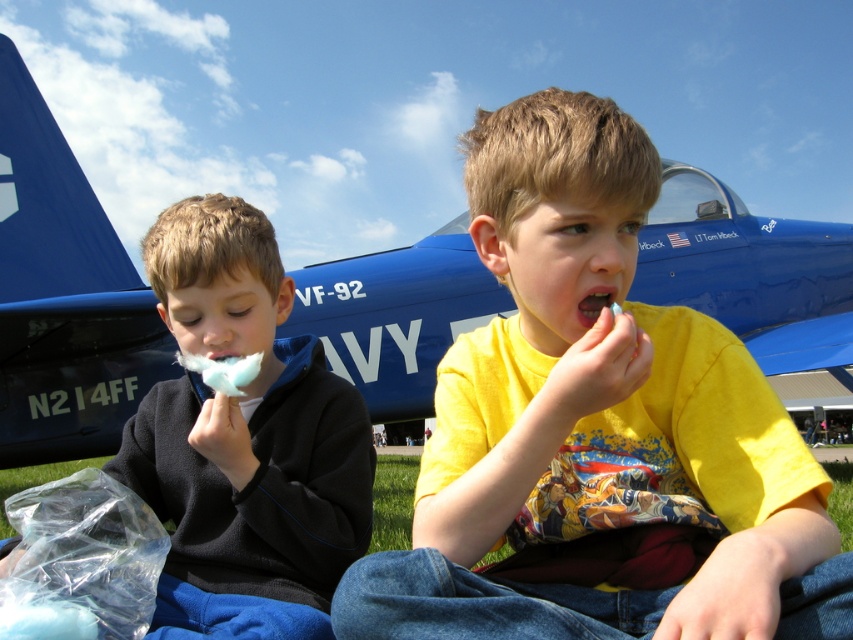
Measure the distance between yellow cotton candy at center and white fluffy cotton candy at left.

They are 70.34 centimeters apart.

Does yellow cotton candy at center have a larger size compared to white fluffy cotton candy at left?

Correct, yellow cotton candy at center is larger in size than white fluffy cotton candy at left.

Between point (735, 540) and point (177, 595), which one is positioned in front?

Point (735, 540) is in front.

Where is `yellow cotton candy at center`? Image resolution: width=853 pixels, height=640 pixels. yellow cotton candy at center is located at coordinates (598, 429).

Between blue glossy airplane at center and white fluffy cotton candy at left, which one appears on the left side from the viewer's perspective?

Positioned to the left is white fluffy cotton candy at left.

Is point (68, 321) closer to viewer compared to point (184, 588)?

No, it is not.

This screenshot has width=853, height=640. I want to click on blue glossy airplane at center, so click(x=62, y=296).

Can you confirm if yellow cotton candy at center is smaller than blue glossy airplane at center?

Actually, yellow cotton candy at center might be larger than blue glossy airplane at center.

What do you see at coordinates (598, 429) in the screenshot?
I see `yellow cotton candy at center` at bounding box center [598, 429].

Identify the location of yellow cotton candy at center. (598, 429).